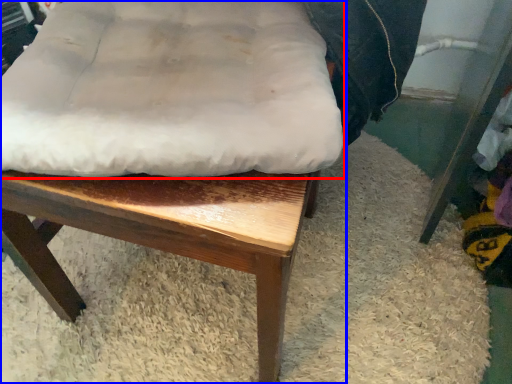
Question: Which of the following is the closest to the observer, sheet (highlighted by a red box) or chair (highlighted by a blue box)?

Choices:
 (A) sheet
 (B) chair

Answer: (B)